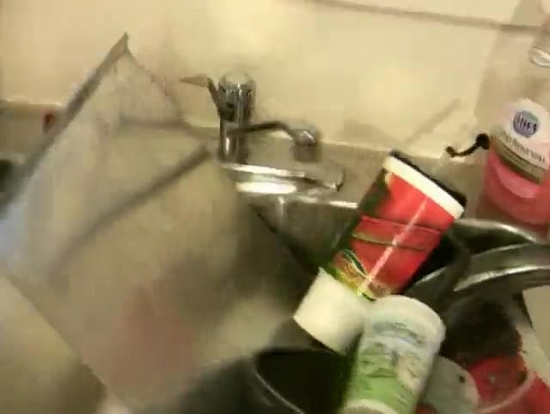
I want to click on large metal baking sheet, so click(188, 305).